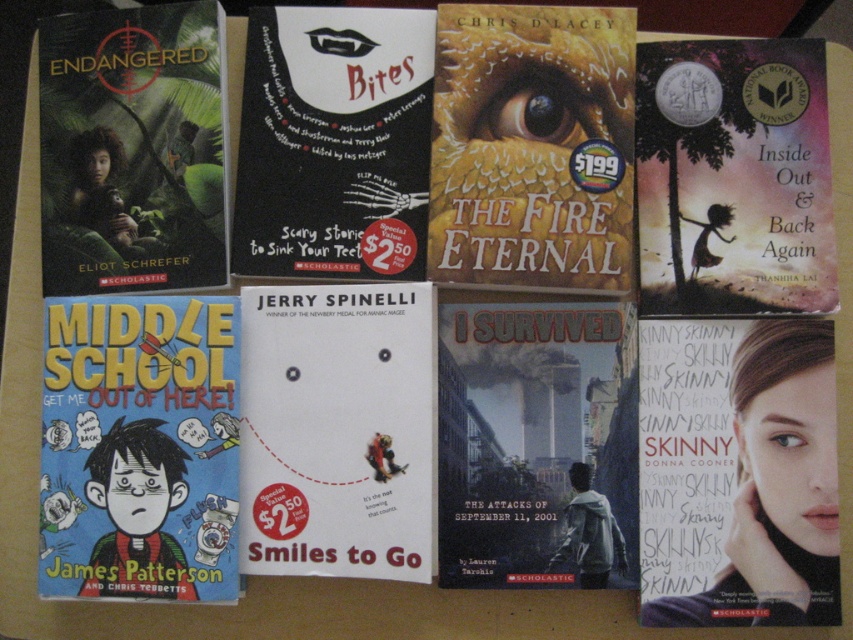
You are organizing books on a desk and notice two items on the top row. The first is a matte green book at upper left, and the second is a matte yellow dragon eye at center. Which item is located to the right of the other?

The matte yellow dragon eye at center is positioned to the right of the matte green book at upper left.

You are a librarian organizing books on a shelf. You have a matte green book at upper left and a matte yellow dragon eye at center. The shelf space between them is 10 inches. Can the dragon eye fit between them?

The matte yellow dragon eye at center is 10.14 inches from the matte green book at upper left. Since the shelf space between them is only 10 inches, the dragon eye cannot fit between them as there is insufficient space.